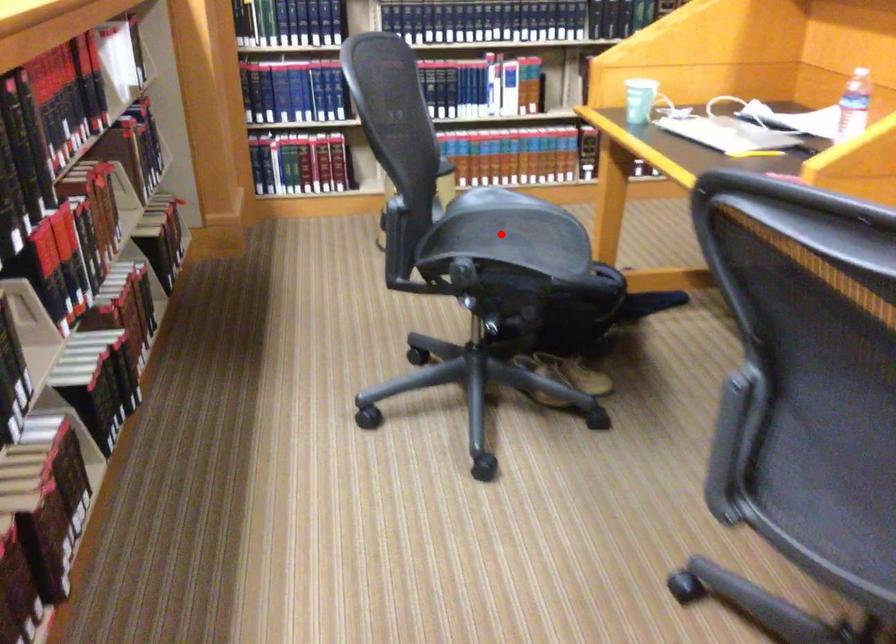
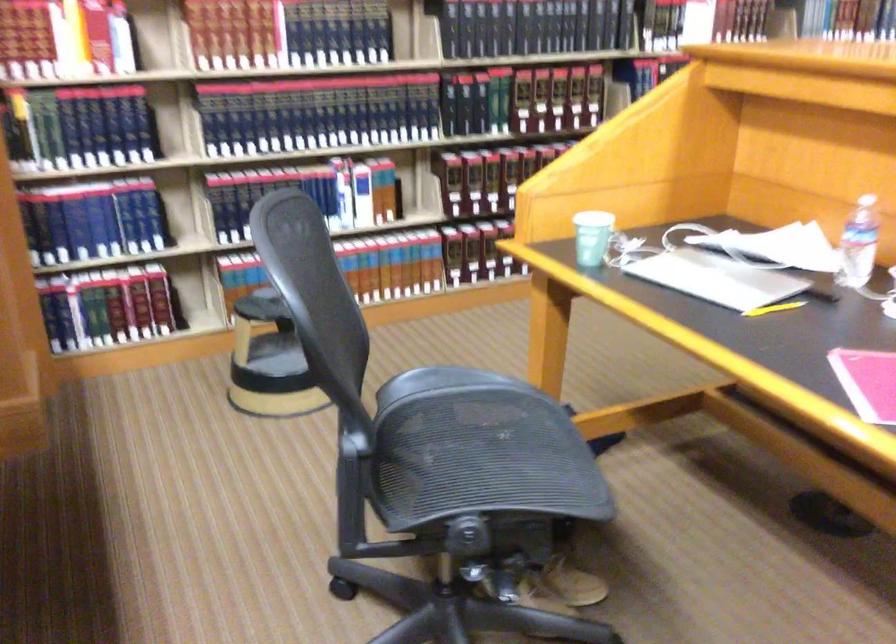
Where in the second image is the point corresponding to the highlighted location from the first image?

(470, 442)